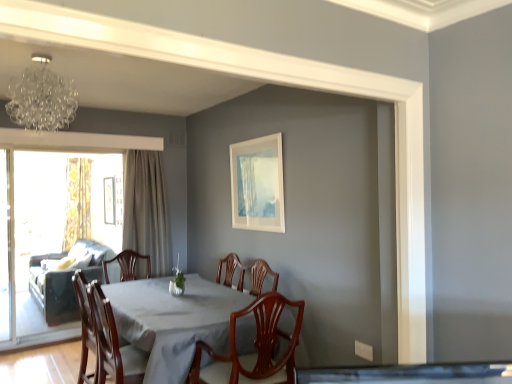
Question: In terms of width, does wooden chair at center, positioned as the 2th chair in right-to-left order, look wider or thinner when compared to transparent glass screen door at left, marked as the 1th screen door in a right-to-left arrangement?

Choices:
 (A) thin
 (B) wide

Answer: (B)

Question: Based on their sizes in the image, would you say wooden chair at center, which ranks as the first chair in left-to-right order, is bigger or smaller than transparent glass screen door at left, marked as the 1th screen door in a right-to-left arrangement?

Choices:
 (A) big
 (B) small

Answer: (A)

Question: Estimate the real-world distances between objects in this image. Which object is closer to the white glossy table at center?

Choices:
 (A) transparent glass screen door at left, marked as the 2th screen door in a left-to-right arrangement
 (B) white matte picture frame at upper center, which is the first picture frame in front-to-back order
 (C) gold textured curtain at left, which is counted as the second curtain, starting from the front
 (D) dark gray fabric couch at left
 (E) mahogany wood chair at center, positioned as the second chair in back-to-front order

Answer: (E)

Question: Estimate the real-world distances between objects in this image. Which object is farther from the wooden chair at center, positioned as the 2th chair in right-to-left order?

Choices:
 (A) white glossy table at center
 (B) transparent glass screen door at left, marked as the 1th screen door in a right-to-left arrangement
 (C) clear glass screen door at left, which ranks as the first screen door in left-to-right order
 (D) white matte picture frame at upper center, which is the first picture frame in front-to-back order
 (E) crystal glass chandelier at upper left

Answer: (C)